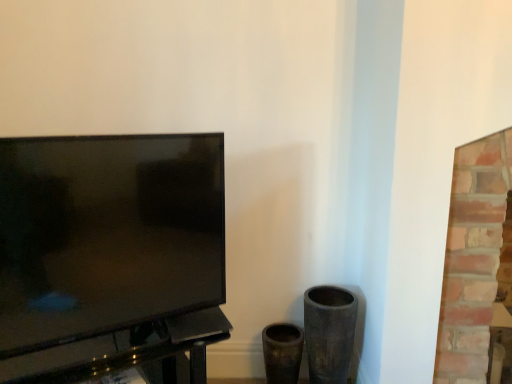
Question: Considering the relative positions of matte black tv at left and brick fireplace at right in the image provided, is matte black tv at left to the right of brick fireplace at right from the viewer's perspective?

Choices:
 (A) no
 (B) yes

Answer: (A)

Question: Does matte black tv at left come behind brick fireplace at right?

Choices:
 (A) yes
 (B) no

Answer: (B)

Question: Can you see matte black tv at left touching brick fireplace at right?

Choices:
 (A) no
 (B) yes

Answer: (A)

Question: Could brick fireplace at right be considered to be inside matte black tv at left?

Choices:
 (A) yes
 (B) no

Answer: (B)

Question: Would you say matte black tv at left is outside brick fireplace at right?

Choices:
 (A) yes
 (B) no

Answer: (A)

Question: Which is correct: brick fireplace at right is inside matte black tv at left, or outside of it?

Choices:
 (A) outside
 (B) inside

Answer: (A)

Question: Is point (459, 296) closer or farther from the camera than point (204, 231)?

Choices:
 (A) farther
 (B) closer

Answer: (A)

Question: Considering their positions, is brick fireplace at right located in front of or behind matte black tv at left?

Choices:
 (A) behind
 (B) front

Answer: (A)

Question: From the image's perspective, relative to matte black tv at left, is brick fireplace at right above or below?

Choices:
 (A) below
 (B) above

Answer: (A)

Question: In terms of height, does black glossy table at left look taller or shorter compared to matte black tv at left?

Choices:
 (A) tall
 (B) short

Answer: (B)

Question: Considering their positions, is black glossy table at left located in front of or behind matte black tv at left?

Choices:
 (A) behind
 (B) front

Answer: (A)

Question: From a real-world perspective, relative to matte black tv at left, is black glossy table at left vertically above or below?

Choices:
 (A) above
 (B) below

Answer: (B)

Question: Is point (72, 365) positioned closer to the camera than point (69, 251)?

Choices:
 (A) closer
 (B) farther

Answer: (B)

Question: Is matte black tv at left in front of or behind black glossy table at left in the image?

Choices:
 (A) behind
 (B) front

Answer: (B)

Question: Would you say matte black tv at left is to the left or to the right of black glossy table at left in the picture?

Choices:
 (A) left
 (B) right

Answer: (B)